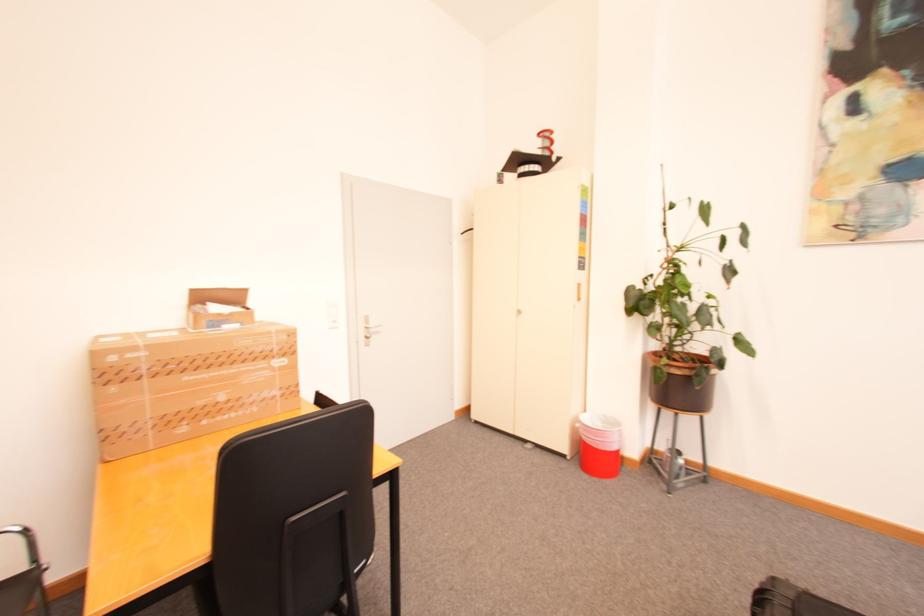
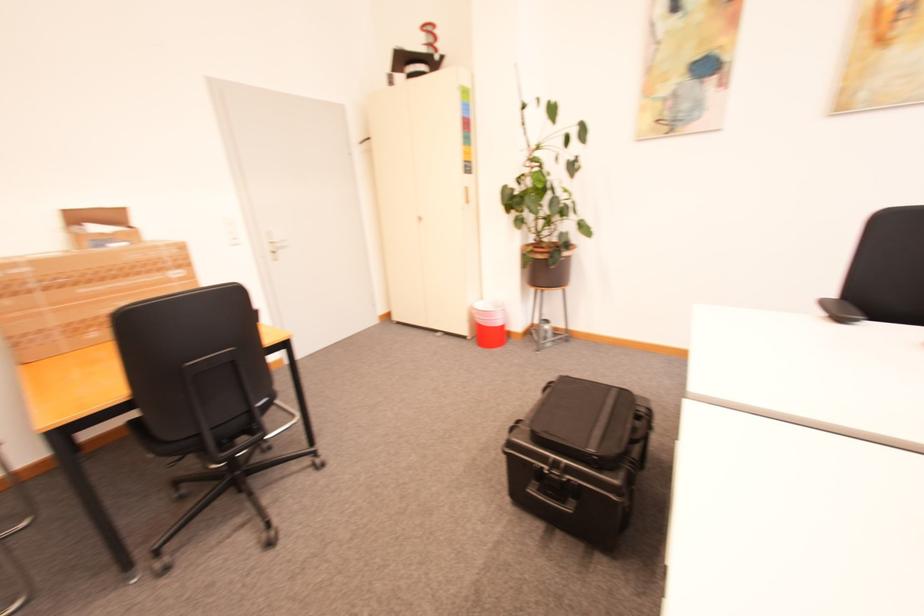
In the second image, find the point that corresponds to point 586,300 in the first image.

(473, 203)